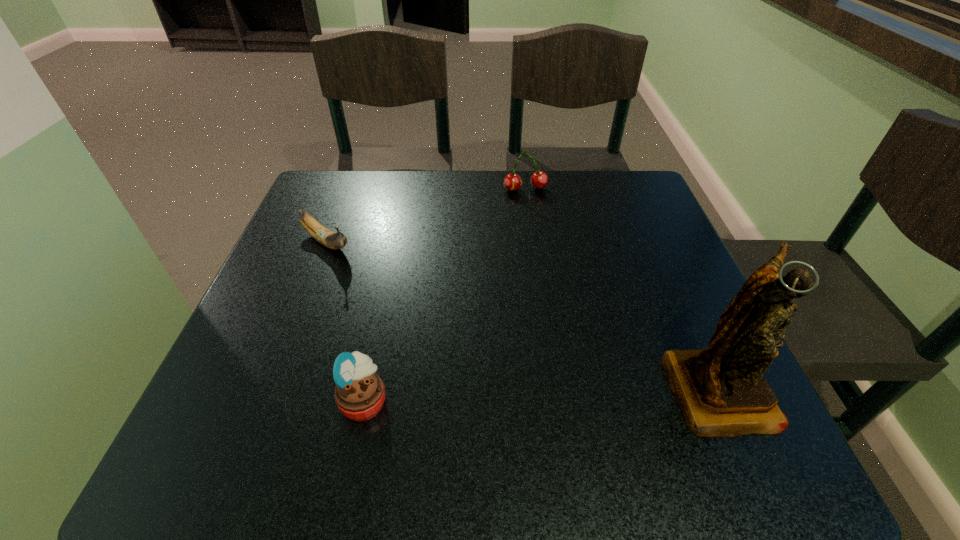
Identify the location of muffin. (359, 393).

This screenshot has height=540, width=960. What are the coordinates of `the tallest object` in the screenshot? It's located at (721, 390).

The image size is (960, 540). In order to click on figurine in this screenshot , I will do `click(721, 390)`.

You are a GUI agent. You are given a task and a screenshot of the screen. Output one action in this format:
    pyautogui.click(x=<x>, y=<y>)
    Task: Click on the leftmost object
    The width and height of the screenshot is (960, 540).
    Given the screenshot: What is the action you would take?
    pyautogui.click(x=328, y=238)

The image size is (960, 540). I want to click on the shortest object, so click(x=328, y=238).

Find the location of `the farthest object`. the farthest object is located at coordinates (539, 179).

Where is `the third object from left to right`? The height and width of the screenshot is (540, 960). the third object from left to right is located at coordinates point(539,179).

Find the location of a particular element. The image size is (960, 540). vacant region located 0.210m on the front-facing side of the muffin is located at coordinates (516, 400).

You are a GUI agent. You are given a task and a screenshot of the screen. Output one action in this format:
    pyautogui.click(x=<x>, y=<y>)
    Task: Click on the free space located on the peel of the shortest object
    
    Given the screenshot: What is the action you would take?
    pyautogui.click(x=448, y=334)

At what (x,y) coordinates should I click in order to perform the action: click on vacant space located on the peel of the shortest object. Please return your answer as a coordinate pair (x, y). This screenshot has width=960, height=540. Looking at the image, I should click on tap(406, 302).